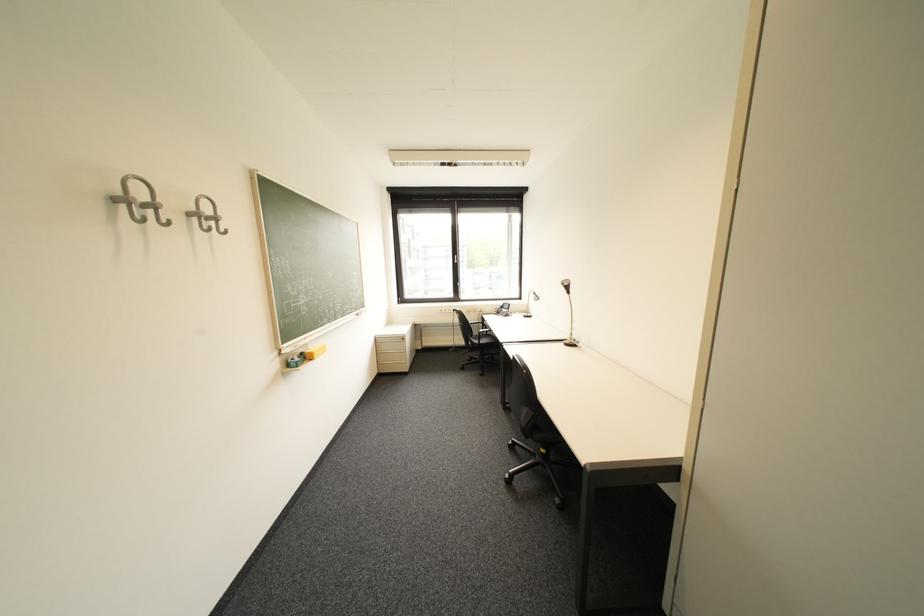
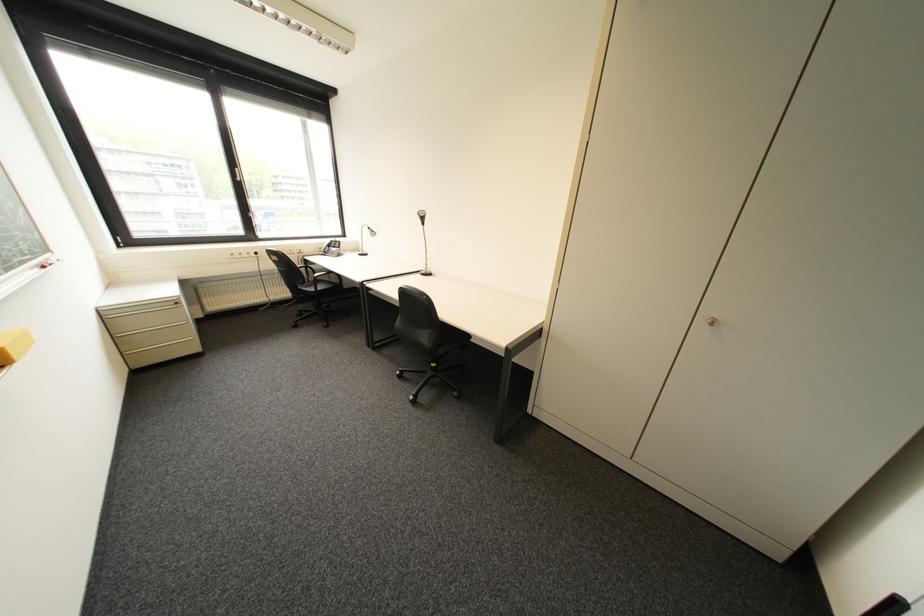
Find the pixel in the second image that matches the point at 575,342 in the first image.

(432, 273)